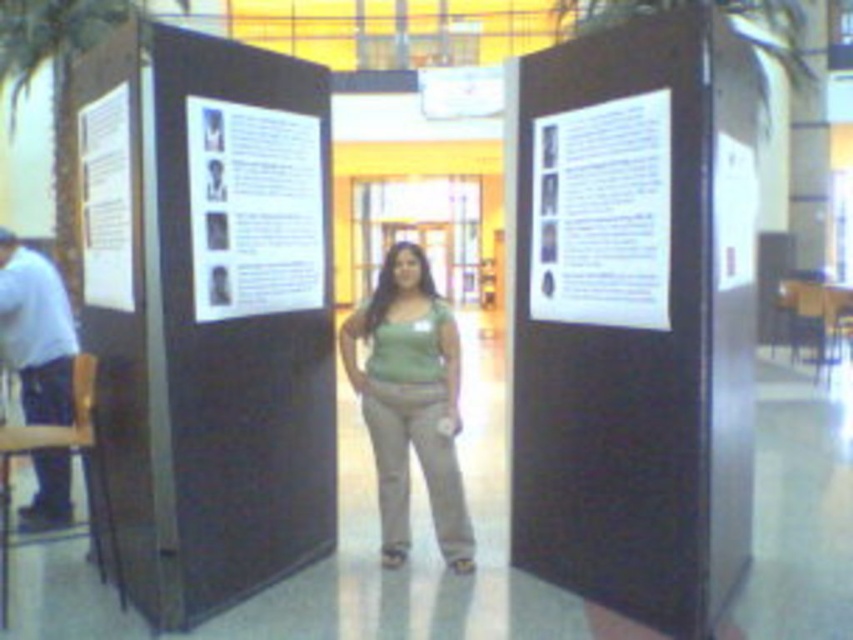
You are a photographer trying to capture a photo of the dark brown wood poster at left and the green matte tank top at center. The camera you are using has a maximum focus range of 3 feet. Can you capture both objects in focus without moving the camera or the subjects?

The dark brown wood poster at left is 3.33 feet from the green matte tank top at center. Since the distance between them exceeds the camera maximum focus range of 3 feet, you cannot capture both objects in focus without moving the camera or the subjects.